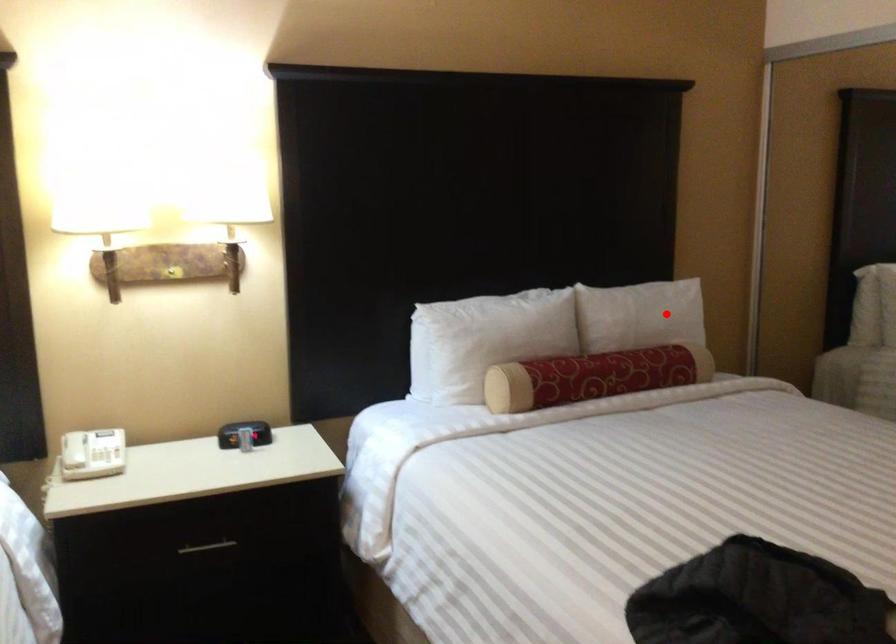
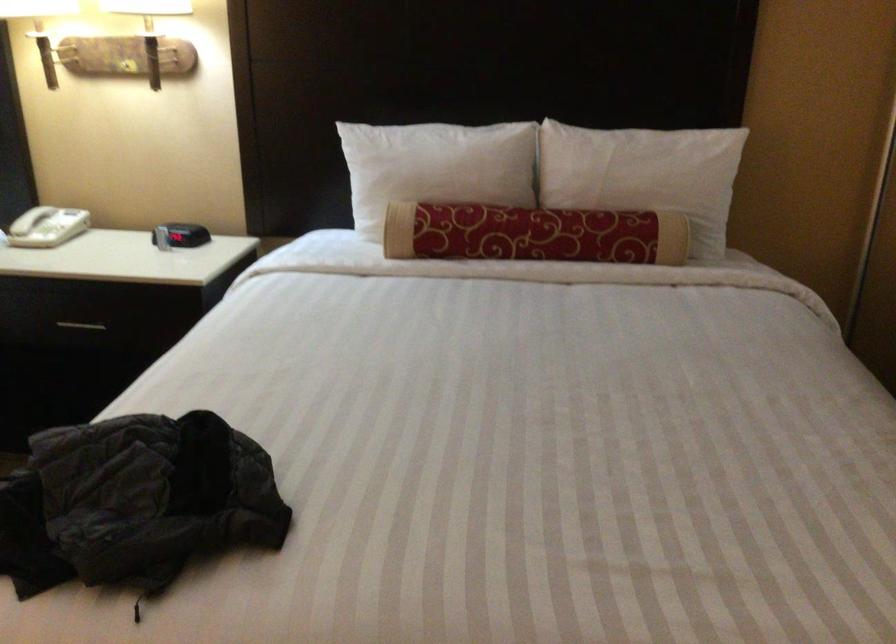
Question: I am providing you with two images of the same scene from different viewpoints. A red point is marked on the first image. Is the red point's position out of view in image 2?

Choices:
 (A) Yes
 (B) No

Answer: (B)